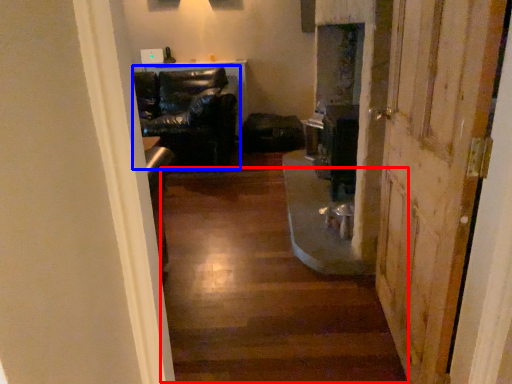
Question: Which of the following is the farthest to the observer, stairwell (highlighted by a red box) or chair (highlighted by a blue box)?

Choices:
 (A) stairwell
 (B) chair

Answer: (B)